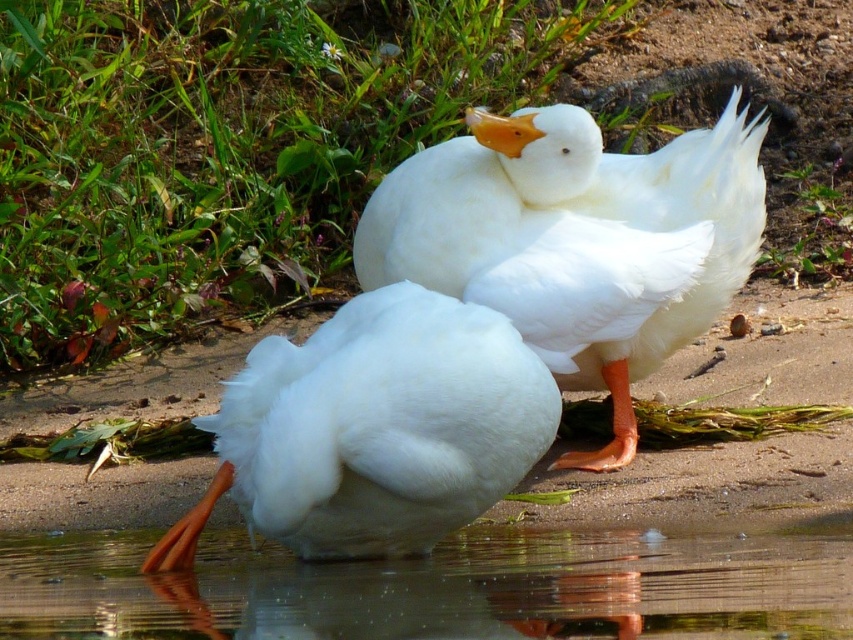
Which of these two, transparent water at lower center or white fluffy duck at center, stands taller?

With more height is white fluffy duck at center.

Between transparent water at lower center and white fluffy duck at center, which one appears on the left side from the viewer's perspective?

transparent water at lower center is more to the left.

Find the location of a particular element. The image size is (853, 640). transparent water at lower center is located at coordinates (439, 588).

You are a GUI agent. You are given a task and a screenshot of the screen. Output one action in this format:
    pyautogui.click(x=<x>, y=<y>)
    Task: Click on the transparent water at lower center
    The image size is (853, 640).
    Given the screenshot: What is the action you would take?
    pyautogui.click(x=439, y=588)

Is transparent water at lower center smaller than white fluffy duck at lower left?

Indeed, transparent water at lower center has a smaller size compared to white fluffy duck at lower left.

Can you confirm if transparent water at lower center is taller than white fluffy duck at lower left?

Incorrect, transparent water at lower center's height is not larger of white fluffy duck at lower left's.

The width and height of the screenshot is (853, 640). Find the location of `transparent water at lower center`. transparent water at lower center is located at coordinates (439, 588).

Does white fluffy duck at center have a lesser width compared to white fluffy duck at lower left?

No.

Can you confirm if white fluffy duck at center is bigger than white fluffy duck at lower left?

Correct, white fluffy duck at center is larger in size than white fluffy duck at lower left.

At what (x,y) coordinates should I click in order to perform the action: click on white fluffy duck at center. Please return your answer as a coordinate pair (x, y). The width and height of the screenshot is (853, 640). Looking at the image, I should click on (576, 241).